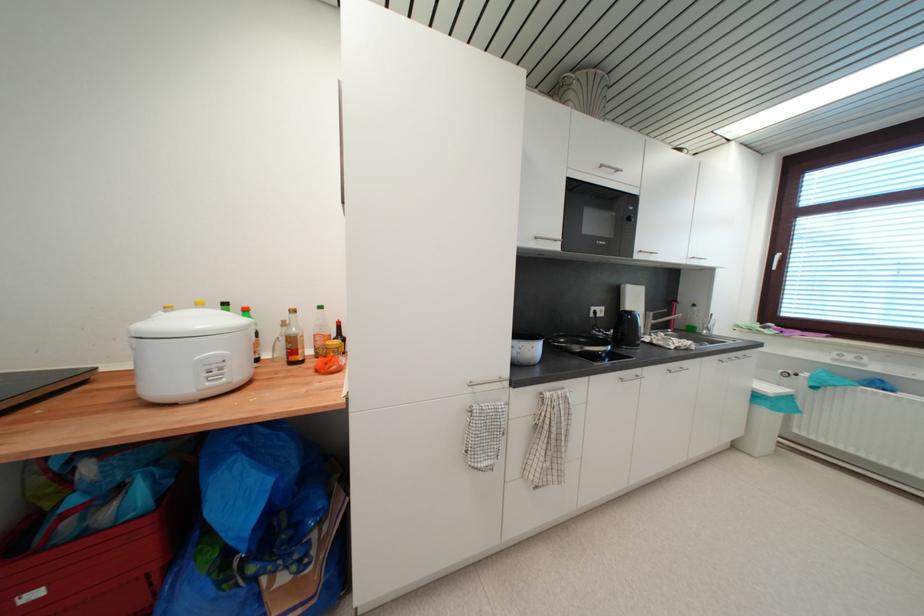
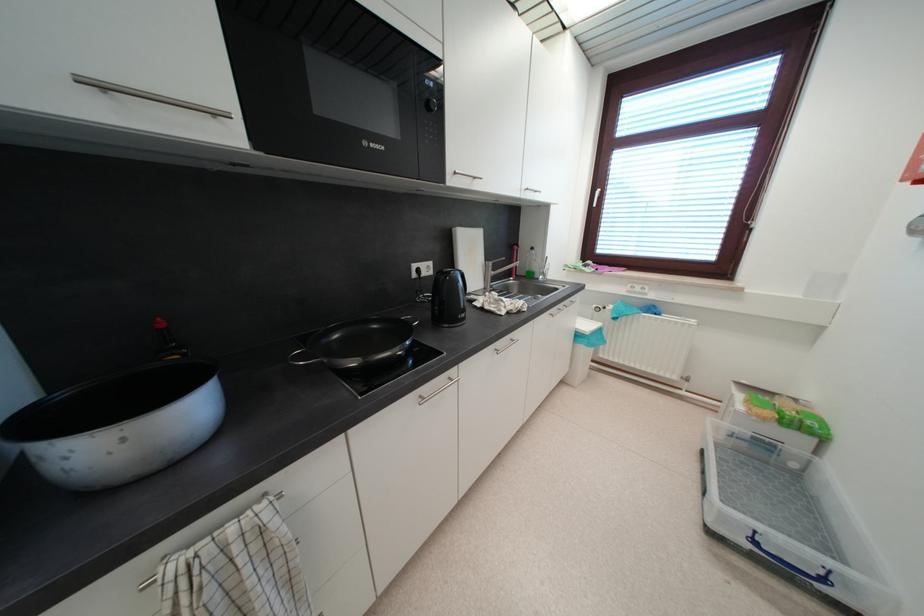
The point at (626, 381) is marked in the first image. Where is the corresponding point in the second image?

(427, 400)